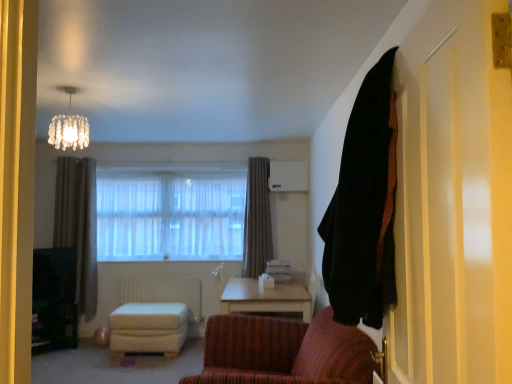
Where is `empty space that is ontop of brown fabric curtain at center, marked as the second curtain in a left-to-right arrangement (from a real-world perspective)`? The height and width of the screenshot is (384, 512). empty space that is ontop of brown fabric curtain at center, marked as the second curtain in a left-to-right arrangement (from a real-world perspective) is located at coordinates (255, 150).